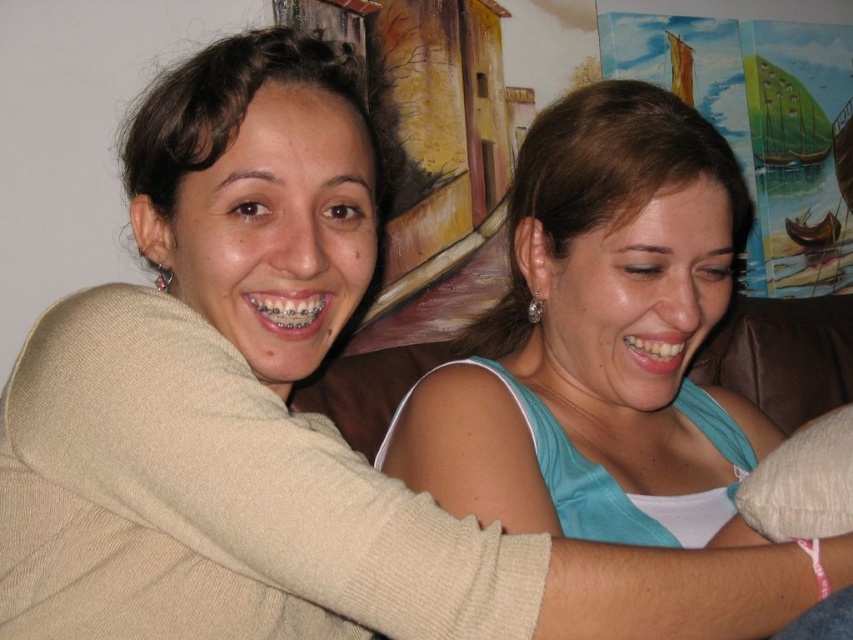
Is point (766, 516) less distant than point (316, 323)?

No, (766, 516) is behind (316, 323).

Which is in front, point (767, 477) or point (277, 317)?

Point (277, 317) is more forward.

I want to click on beige fabric pillow at lower right, so click(802, 483).

Is beige fabric pillow at lower right bigger than white glossy teeth at center?

Indeed, beige fabric pillow at lower right has a larger size compared to white glossy teeth at center.

The height and width of the screenshot is (640, 853). I want to click on beige fabric pillow at lower right, so click(x=802, y=483).

Can you confirm if metallic braces at center is positioned to the right of white glossy teeth at center?

In fact, metallic braces at center is to the left of white glossy teeth at center.

Who is positioned more to the right, metallic braces at center or white glossy teeth at center?

Positioned to the right is white glossy teeth at center.

Which is in front, point (258, 316) or point (662, 346)?

Point (258, 316) is in front.

Locate an element on the screen. Image resolution: width=853 pixels, height=640 pixels. metallic braces at center is located at coordinates (289, 310).